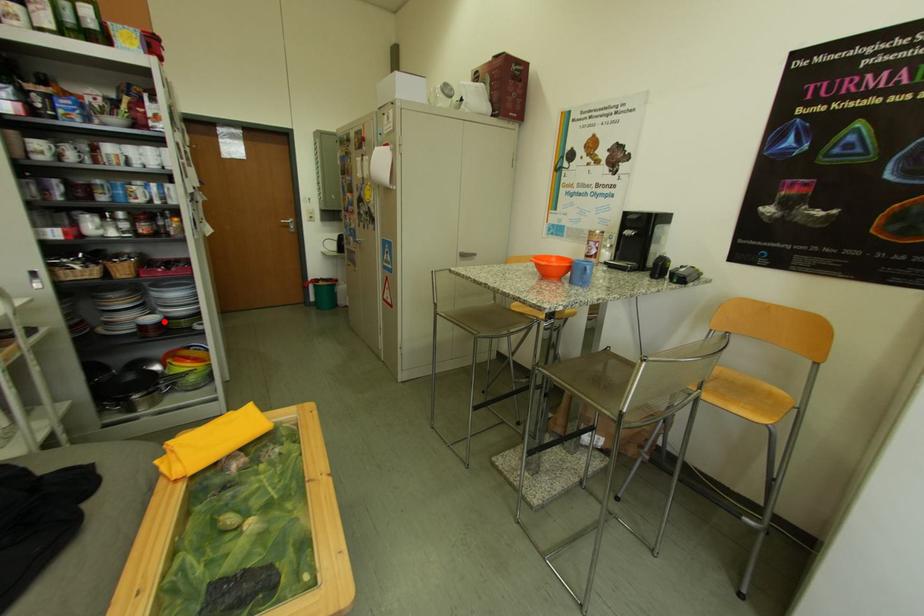
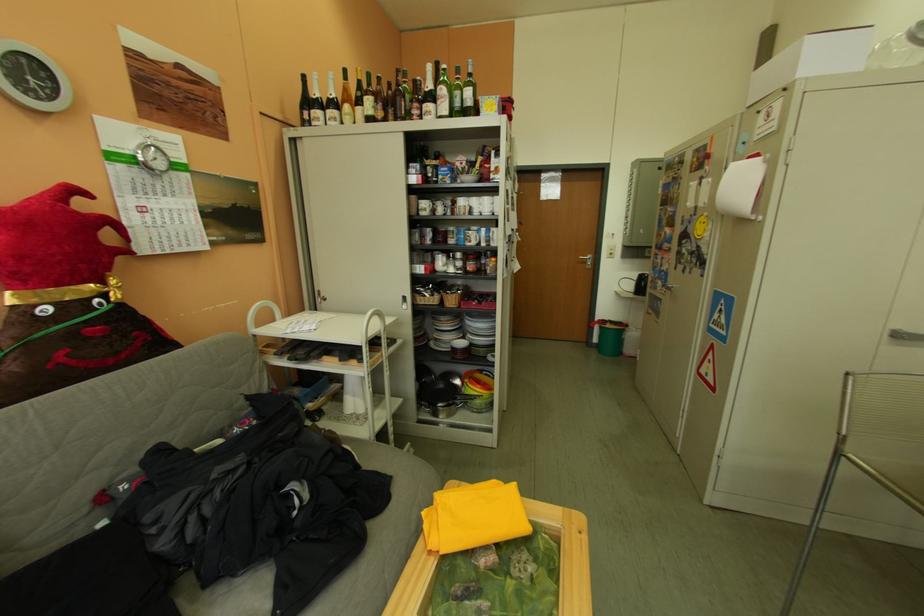
Find the pixel in the second image that matches the highlighted location in the first image.

(473, 346)